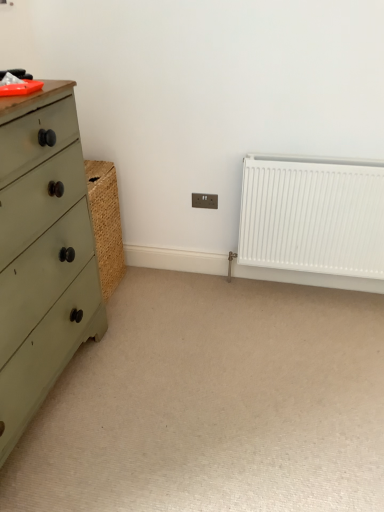
Locate an element on the screen. The image size is (384, 512). free region on the left part of white matte radiator at right is located at coordinates (223, 305).